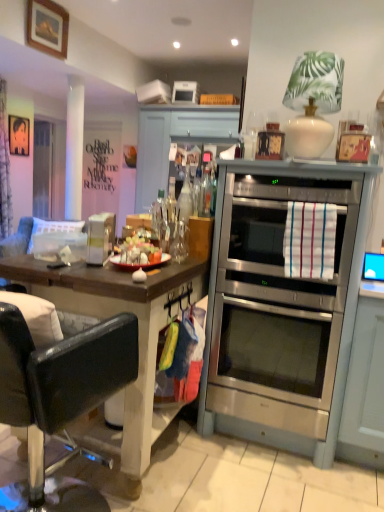
Question: Can you confirm if stainless steel oven at center is shorter than transparent glass door at left?

Choices:
 (A) no
 (B) yes

Answer: (B)

Question: Is stainless steel oven at center oriented towards transparent glass door at left?

Choices:
 (A) yes
 (B) no

Answer: (B)

Question: Would you say stainless steel oven at center is outside transparent glass door at left?

Choices:
 (A) yes
 (B) no

Answer: (A)

Question: Can you confirm if stainless steel oven at center is positioned to the left of transparent glass door at left?

Choices:
 (A) yes
 (B) no

Answer: (B)

Question: From a real-world perspective, does stainless steel oven at center sit lower than transparent glass door at left?

Choices:
 (A) yes
 (B) no

Answer: (A)

Question: Which is correct: transparent glass door at left is inside stainless steel oven at center, or outside of it?

Choices:
 (A) outside
 (B) inside

Answer: (A)

Question: Considering the positions of point (41, 145) and point (244, 276), is point (41, 145) closer or farther from the camera than point (244, 276)?

Choices:
 (A) closer
 (B) farther

Answer: (B)

Question: Is transparent glass door at left wider or thinner than stainless steel oven at center?

Choices:
 (A) wide
 (B) thin

Answer: (B)

Question: Relative to stainless steel oven at center, is transparent glass door at left in front or behind?

Choices:
 (A) front
 (B) behind

Answer: (B)

Question: From a real-world perspective, is metallic silver picture frame at upper left, the 1th picture frame viewed from the left, positioned above or below transparent glass door at left?

Choices:
 (A) above
 (B) below

Answer: (A)

Question: Considering the positions of point (29, 126) and point (51, 193), is point (29, 126) closer or farther from the camera than point (51, 193)?

Choices:
 (A) farther
 (B) closer

Answer: (B)

Question: In the image, is metallic silver picture frame at upper left, which is counted as the second picture frame, starting from the front, on the left side or the right side of transparent glass door at left?

Choices:
 (A) right
 (B) left

Answer: (A)

Question: From the image's perspective, is metallic silver picture frame at upper left, the 1th picture frame viewed from the back, positioned above or below transparent glass door at left?

Choices:
 (A) below
 (B) above

Answer: (B)

Question: From the image's perspective, relative to white plastic toaster at upper center, is metallic silver picture frame at upper left, which is counted as the 2th picture frame, starting from the right, above or below?

Choices:
 (A) above
 (B) below

Answer: (B)

Question: Is metallic silver picture frame at upper left, the 1th picture frame viewed from the back, in front of or behind white plastic toaster at upper center in the image?

Choices:
 (A) front
 (B) behind

Answer: (B)